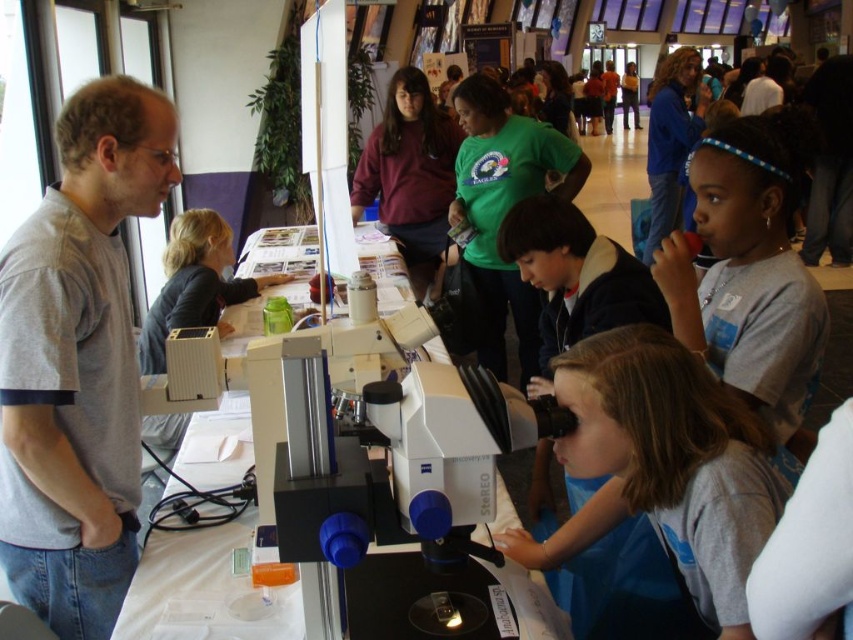
Question: Observing the image, what is the correct spatial positioning of white plastic microscope at center in reference to light brown hair at center?

Choices:
 (A) left
 (B) right

Answer: (A)

Question: Estimate the real-world distances between objects in this image. Which object is closer to the light brown hair at center?

Choices:
 (A) white plastic microscope at center
 (B) gray cotton shirt at left

Answer: (A)

Question: From the image, what is the correct spatial relationship of gray cotton shirt at left in relation to white plastic microscope at center?

Choices:
 (A) above
 (B) below

Answer: (A)

Question: Which of the following is the farthest from the observer?

Choices:
 (A) (360, 618)
 (B) (122, 438)

Answer: (B)

Question: Which object is the farthest from the white plastic microscope at center?

Choices:
 (A) light brown hair at center
 (B) gray cotton shirt at left

Answer: (B)

Question: Does gray cotton shirt at left have a greater width compared to white plastic microscope at center?

Choices:
 (A) no
 (B) yes

Answer: (A)